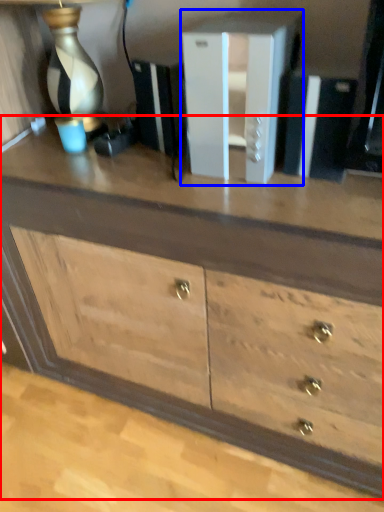
Question: Among these objects, which one is nearest to the camera, chest of drawers (highlighted by a red box) or file cabinet (highlighted by a blue box)?

Choices:
 (A) chest of drawers
 (B) file cabinet

Answer: (A)